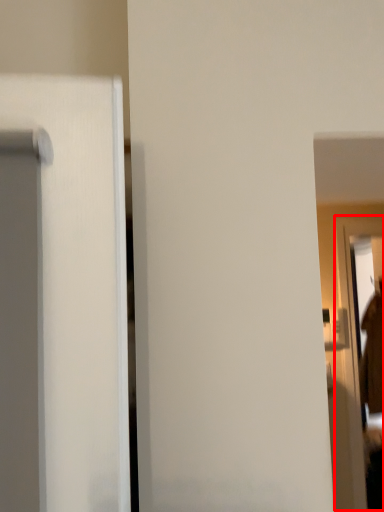
Question: Considering the relative positions of screen door (annotated by the red box) and robe in the image provided, where is screen door (annotated by the red box) located with respect to the staircase?

Choices:
 (A) left
 (B) right

Answer: (A)